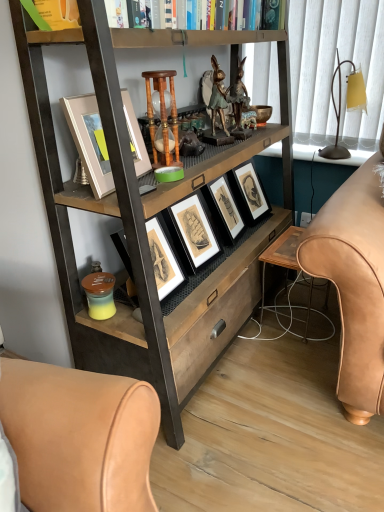
Question: From the image's perspective, is matte white picture frame at upper center, marked as the first picture frame in a left-to-right arrangement, beneath sepia-toned paper picture frame at center, arranged as the first picture frame when viewed from the back?

Choices:
 (A) yes
 (B) no

Answer: (B)

Question: Are matte white picture frame at upper center, arranged as the second picture frame when viewed from the right, and sepia-toned paper picture frame at center, acting as the 1th picture frame starting from the right, far apart?

Choices:
 (A) yes
 (B) no

Answer: (B)

Question: Is matte white picture frame at upper center, marked as the first picture frame in a left-to-right arrangement, further to camera compared to sepia-toned paper picture frame at center, acting as the 1th picture frame starting from the right?

Choices:
 (A) yes
 (B) no

Answer: (B)

Question: Can you confirm if matte white picture frame at upper center, the 2th picture frame positioned from the back, is shorter than sepia-toned paper picture frame at center, arranged as the first picture frame when viewed from the back?

Choices:
 (A) yes
 (B) no

Answer: (A)

Question: From a real-world perspective, is matte white picture frame at upper center, acting as the 1th picture frame starting from the front, positioned over sepia-toned paper picture frame at center, which is counted as the second picture frame, starting from the left, based on gravity?

Choices:
 (A) no
 (B) yes

Answer: (B)

Question: Is matte white picture frame at upper center, acting as the 1th picture frame starting from the front, positioned in front of sepia-toned paper picture frame at center, which is counted as the second picture frame, starting from the left?

Choices:
 (A) yes
 (B) no

Answer: (A)

Question: Can you confirm if wooden hourglass at center is taller than wooden table at lower center?

Choices:
 (A) yes
 (B) no

Answer: (B)

Question: Is wooden hourglass at center closer to the viewer compared to wooden table at lower center?

Choices:
 (A) no
 (B) yes

Answer: (B)

Question: Is wooden hourglass at center oriented away from wooden table at lower center?

Choices:
 (A) no
 (B) yes

Answer: (A)

Question: Can you confirm if wooden hourglass at center is positioned to the left of wooden table at lower center?

Choices:
 (A) yes
 (B) no

Answer: (A)

Question: Would you say wooden hourglass at center is outside wooden table at lower center?

Choices:
 (A) yes
 (B) no

Answer: (A)

Question: Does wooden hourglass at center have a lesser width compared to wooden table at lower center?

Choices:
 (A) no
 (B) yes

Answer: (B)

Question: Considering the relative sizes of wooden table at lower center and green patinated metal rabbit at center in the image provided, is wooden table at lower center shorter than green patinated metal rabbit at center?

Choices:
 (A) no
 (B) yes

Answer: (A)